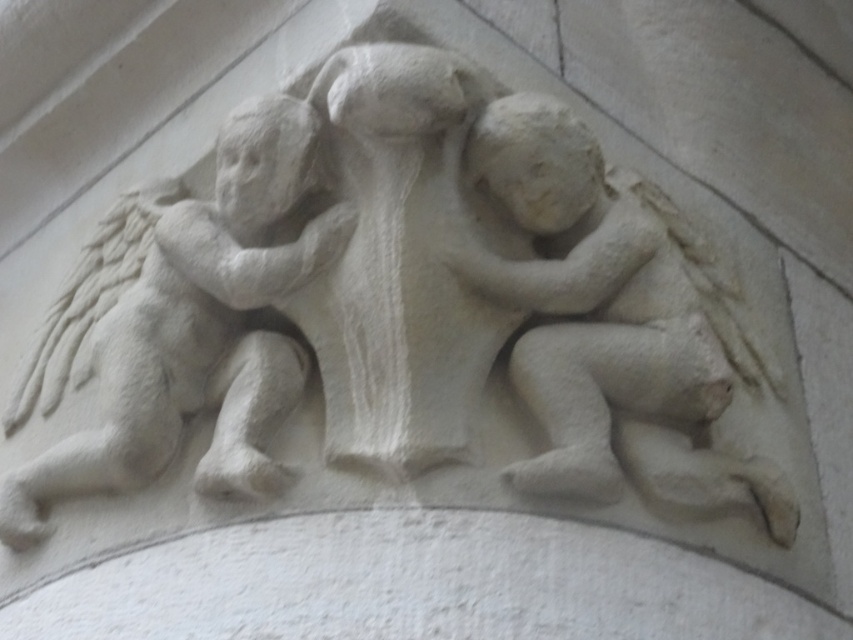
Based on the scene, if you were to draw a vertical line down the middle of the image, which cherub would be closer to the right side of the line? The white stone cherub at center or the white stone cherub at upper left?

The white stone cherub at center is to the right of the white stone cherub at upper left, so it would be closer to the right side of the line.